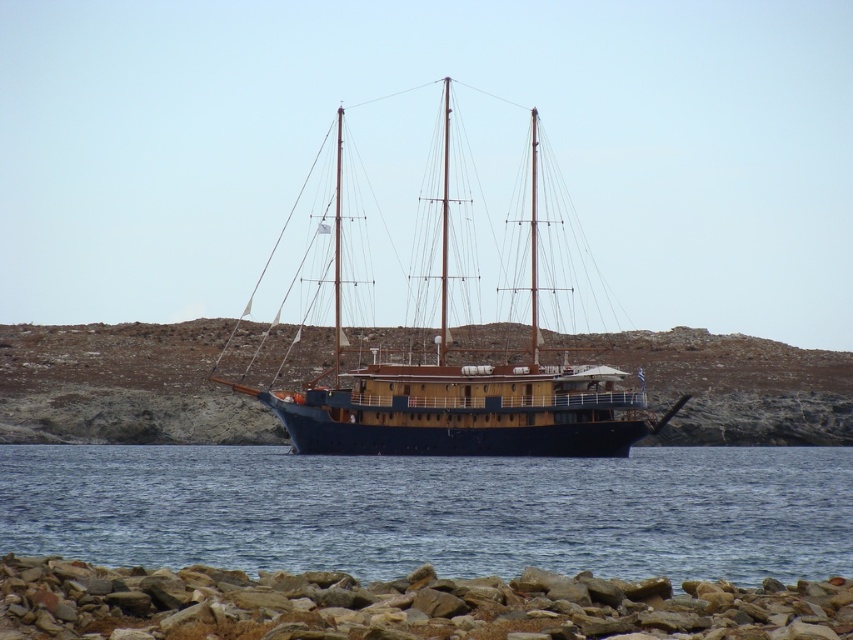
Who is higher up, rusty stone rocks at lower center or blue wooden sailboat at center?

blue wooden sailboat at center is higher up.

You are a GUI agent. You are given a task and a screenshot of the screen. Output one action in this format:
    pyautogui.click(x=<x>, y=<y>)
    Task: Click on the rusty stone rocks at lower center
    This screenshot has width=853, height=640.
    Given the screenshot: What is the action you would take?
    pyautogui.click(x=399, y=605)

This screenshot has width=853, height=640. What are the coordinates of `rusty stone rocks at lower center` in the screenshot? It's located at (399, 605).

Is blue water at center smaller than rusty stone rocks at lower center?

Incorrect, blue water at center is not smaller in size than rusty stone rocks at lower center.

Is blue water at center closer to the viewer compared to rusty stone rocks at lower center?

No, it is behind rusty stone rocks at lower center.

Where is `blue water at center`? This screenshot has height=640, width=853. blue water at center is located at coordinates (434, 509).

Is blue water at center further to camera compared to blue wooden sailboat at center?

No, it is not.

Is blue water at center taller than blue wooden sailboat at center?

Incorrect, blue water at center's height is not larger of blue wooden sailboat at center's.

Is point (756, 483) in front of point (426, 392)?

That is True.

At what (x,y) coordinates should I click in order to perform the action: click on blue water at center. Please return your answer as a coordinate pair (x, y). Looking at the image, I should click on (434, 509).